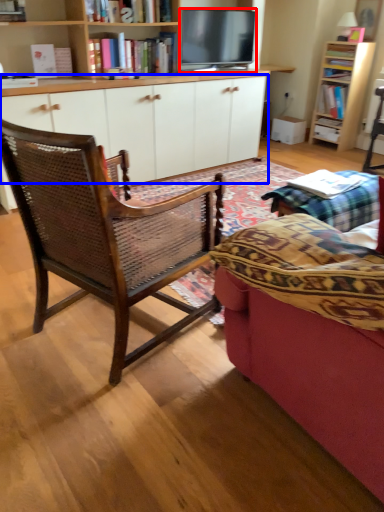
Question: Which point is further to the camera, television (highlighted by a red box) or cabinetry (highlighted by a blue box)?

Choices:
 (A) television
 (B) cabinetry

Answer: (A)